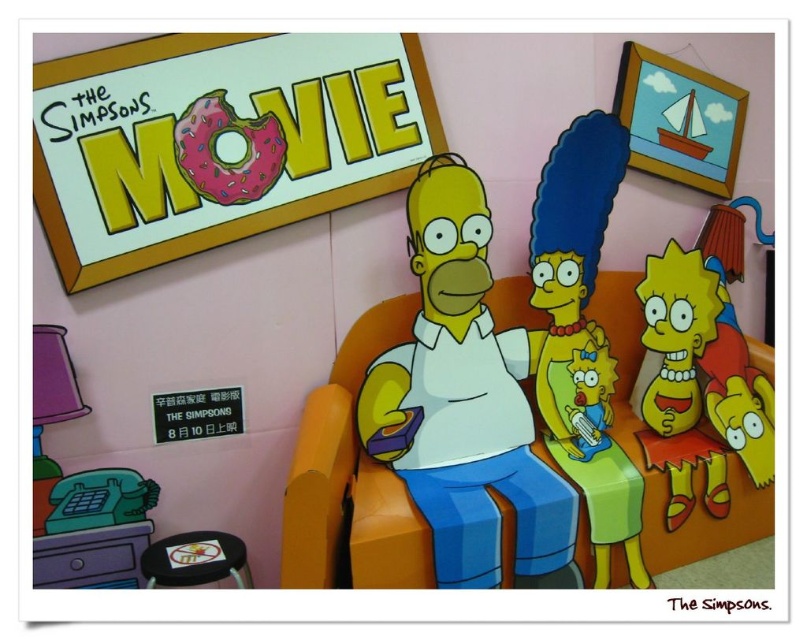
Does point (550, 403) come closer to viewer compared to point (178, 157)?

No, (550, 403) is behind (178, 157).

What do you see at coordinates (582, 336) in the screenshot?
I see `blue plastic doll at center` at bounding box center [582, 336].

In order to click on blue plastic doll at center in this screenshot , I will do coord(582,336).

From the picture: Who is positioned more to the left, yellow matte homer simpson at center or pink frosted donut at upper left?

pink frosted donut at upper left is more to the left.

Is the position of yellow matte homer simpson at center less distant than that of pink frosted donut at upper left?

Yes, yellow matte homer simpson at center is in front of pink frosted donut at upper left.

Is point (404, 435) closer to viewer compared to point (278, 129)?

No, (404, 435) is further to viewer.

Locate an element on the screen. The image size is (807, 640). yellow matte homer simpson at center is located at coordinates (463, 403).

Can you confirm if pink frosted donut at upper left is positioned to the left of black rubber stool at lower left?

Incorrect, pink frosted donut at upper left is not on the left side of black rubber stool at lower left.

Is point (257, 170) in front of point (144, 552)?

No, it is not.

You are a GUI agent. You are given a task and a screenshot of the screen. Output one action in this format:
    pyautogui.click(x=<x>, y=<y>)
    Task: Click on the pink frosted donut at upper left
    This screenshot has height=640, width=807.
    Given the screenshot: What is the action you would take?
    pyautogui.click(x=224, y=150)